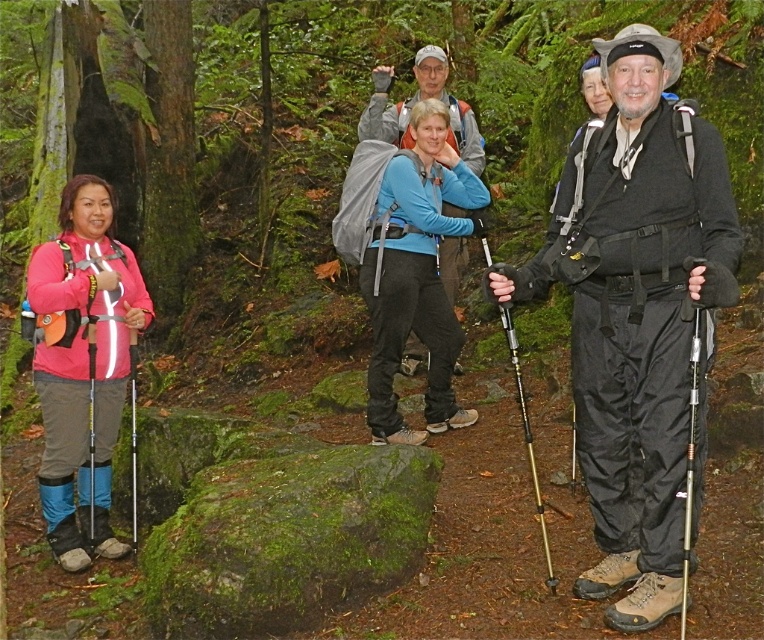
Question: Which point is farther to the camera?

Choices:
 (A) matte black ski pole at left
 (B) yellow metallic ski pole at left
 (C) pink fabric jacket at left

Answer: (A)

Question: Which object is closer to the camera taking this photo?

Choices:
 (A) silver metallic ski pole at right
 (B) black metallic pole at right

Answer: (A)

Question: Can you confirm if silver metallic ski pole at right is wider than yellow metallic ski pole at left?

Choices:
 (A) no
 (B) yes

Answer: (A)

Question: Is matte black backpack at center below blue matte jacket at center?

Choices:
 (A) yes
 (B) no

Answer: (A)

Question: Which point is closer to the camera?

Choices:
 (A) (131, 344)
 (B) (79, 237)
 (C) (685, 515)
 (D) (681, 163)

Answer: (C)

Question: Can you confirm if matte black backpack at center is positioned above matte black ski pole at left?

Choices:
 (A) no
 (B) yes

Answer: (B)